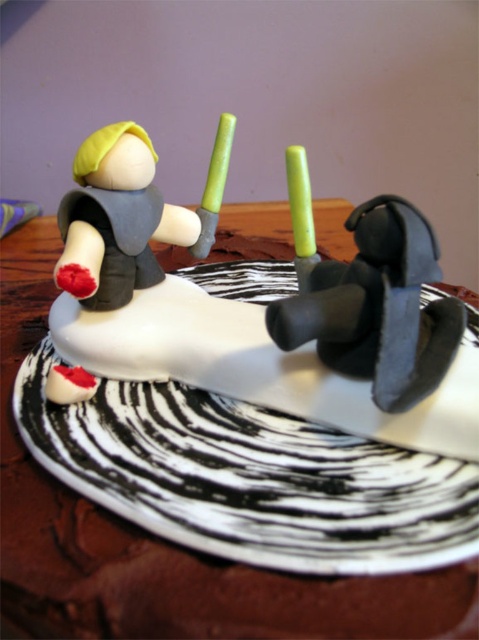
Who is lower down, green wax candle at center or green plastic candle at center?

green wax candle at center is lower down.

Which is in front, point (291, 209) or point (229, 145)?

Point (291, 209) is in front.

Image resolution: width=479 pixels, height=640 pixels. I want to click on green wax candle at center, so click(x=300, y=214).

Who is lower down, matte gray figure at upper left or green wax candle at center?

matte gray figure at upper left is lower down.

Is matte gray figure at upper left positioned in front of green wax candle at center?

That is True.

Measure the distance between point (173, 205) and camera.

They are 32.45 inches apart.

Locate an element on the screen. matte gray figure at upper left is located at coordinates (115, 220).

Which is below, matte black propeller at center or green wax candle at center?

matte black propeller at center is below.

Does matte black propeller at center lie in front of green wax candle at center?

That is True.

The image size is (479, 640). Describe the element at coordinates (377, 307) in the screenshot. I see `matte black propeller at center` at that location.

Where is `matte black propeller at center`? This screenshot has height=640, width=479. matte black propeller at center is located at coordinates (377, 307).